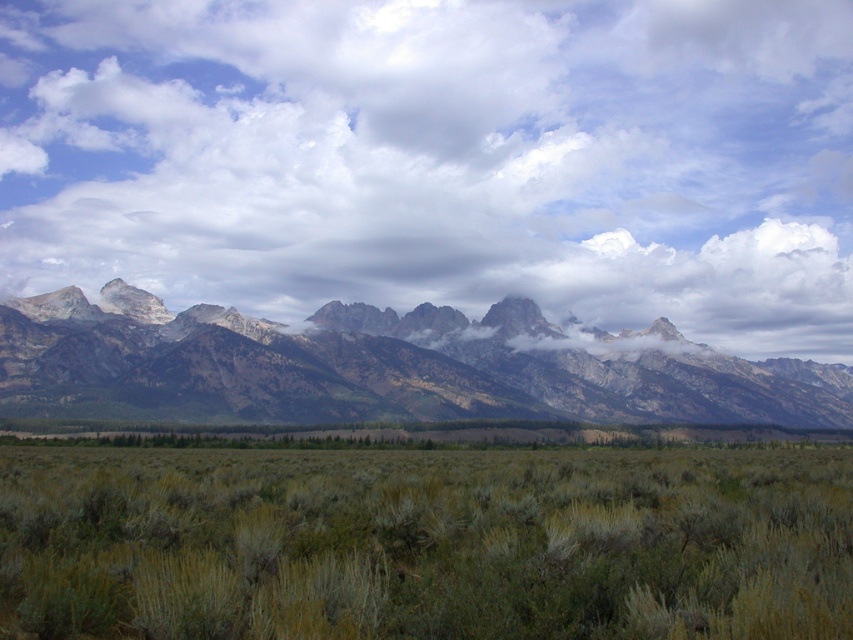
Question: Which of the following is the farthest from the observer?

Choices:
 (A) green shrubbery at center
 (B) gray rock mountain range at center

Answer: (B)

Question: Is cloudy sky at upper center positioned in front of green shrubbery at center?

Choices:
 (A) yes
 (B) no

Answer: (B)

Question: Is cloudy sky at upper center smaller than green shrubbery at center?

Choices:
 (A) yes
 (B) no

Answer: (B)

Question: Which of the following is the closest to the observer?

Choices:
 (A) green shrubbery at center
 (B) gray rock mountain range at center

Answer: (A)

Question: In this image, where is green shrubbery at center located relative to gray rock mountain range at center?

Choices:
 (A) left
 (B) right

Answer: (A)

Question: Which object appears farthest from the camera in this image?

Choices:
 (A) gray rock mountain range at center
 (B) cloudy sky at upper center
 (C) green shrubbery at center

Answer: (B)